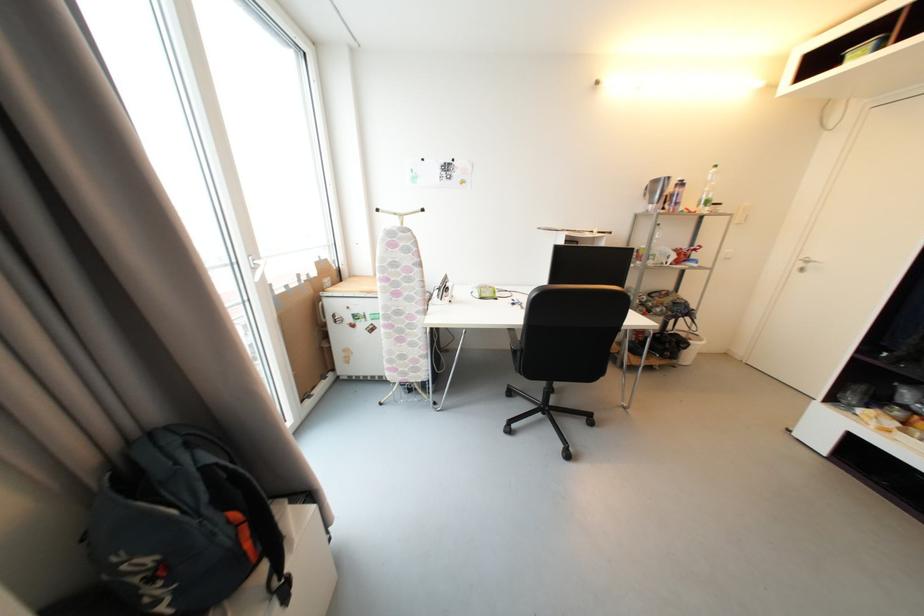
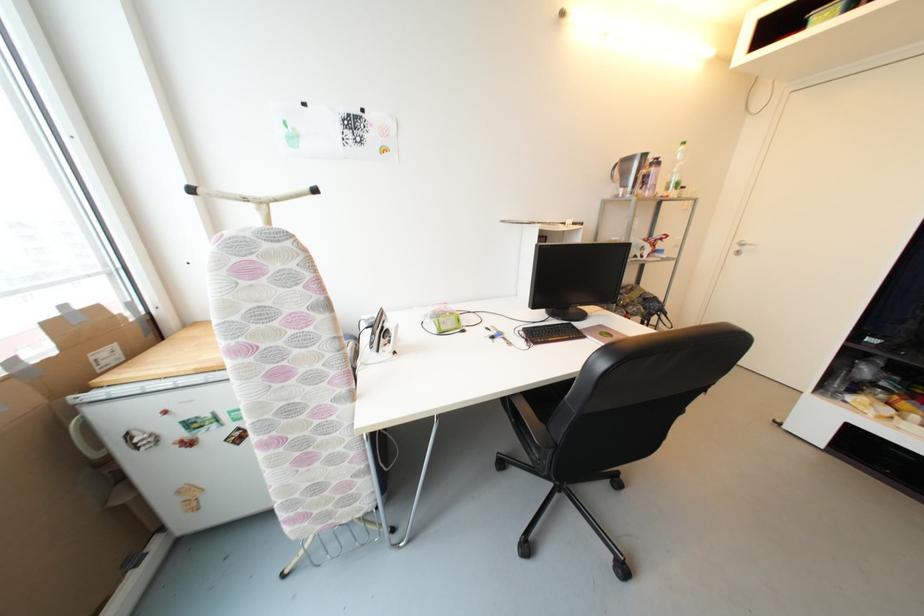
The point at (383, 213) is marked in the first image. Where is the corresponding point in the second image?

(197, 192)